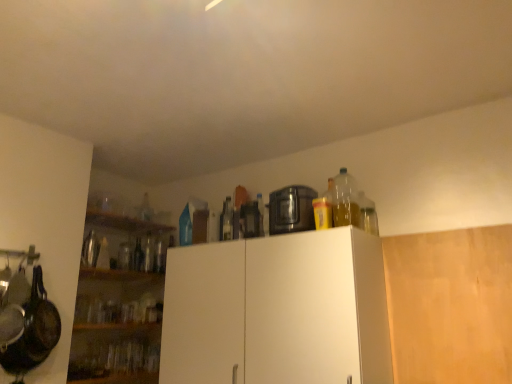
Question: Would you say clear glass bottle at center, the 2th bottle viewed from the left, is to the left or to the right of clear glass bottle at center, acting as the third bottle starting from the back, in the picture?

Choices:
 (A) right
 (B) left

Answer: (B)

Question: Considering the positions of clear glass bottle at center, the 2th bottle viewed from the left, and clear glass bottle at center, which ranks as the third bottle in left-to-right order, in the image, is clear glass bottle at center, the 2th bottle viewed from the left, bigger or smaller than clear glass bottle at center, which ranks as the third bottle in left-to-right order,?

Choices:
 (A) big
 (B) small

Answer: (A)

Question: Considering the real-world distances, which object is closest to the clear glass bottle at center, acting as the third bottle starting from the back?

Choices:
 (A) wooden shelves at upper center
 (B) wooden cabinet at upper right, the first cabinetry positioned from the right
 (C) clear glass bottle at center, the 2th bottle viewed from the left
 (D) translucent plastic bottle at upper right, which is the fourth bottle in left-to-right order
 (E) white matte cabinet at upper center, which is the 1th cabinetry from left to right

Answer: (E)

Question: Estimate the real-world distances between objects in this image. Which object is farther from the black plastic toaster at upper center, the 2th appliance when ordered from left to right?

Choices:
 (A) wooden cabinet at upper right, the first cabinetry positioned from the right
 (B) brushed metal thermos at left, which is the 3th appliance from right to left
 (C) translucent plastic bottle at upper right, the fourth bottle in the back-to-front sequence
 (D) transparent plastic bottle at upper center, which is the first bottle from left to right
 (E) wooden shelves at upper center

Answer: (D)